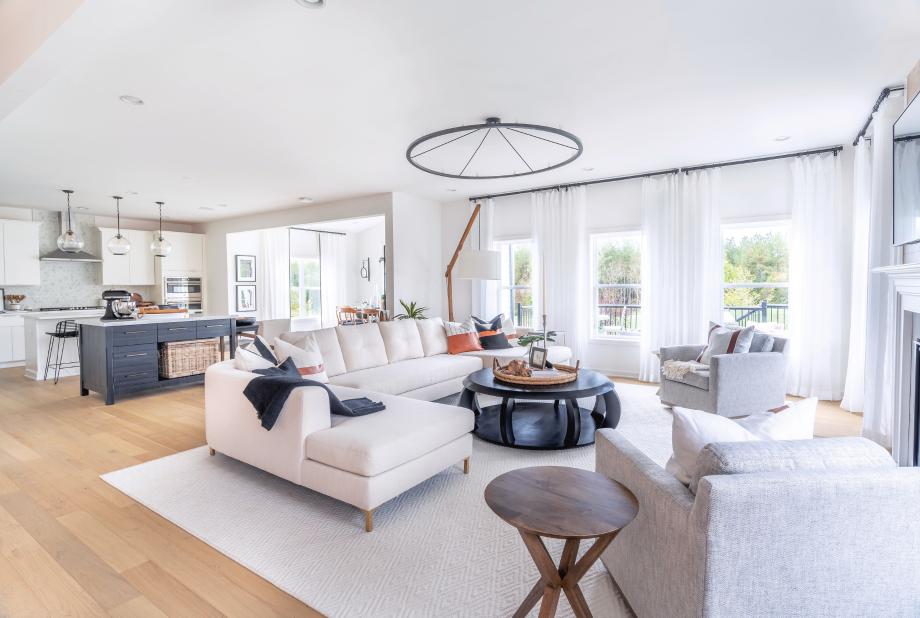
What are the coordinates of `tray` in the screenshot? It's located at (549, 375).